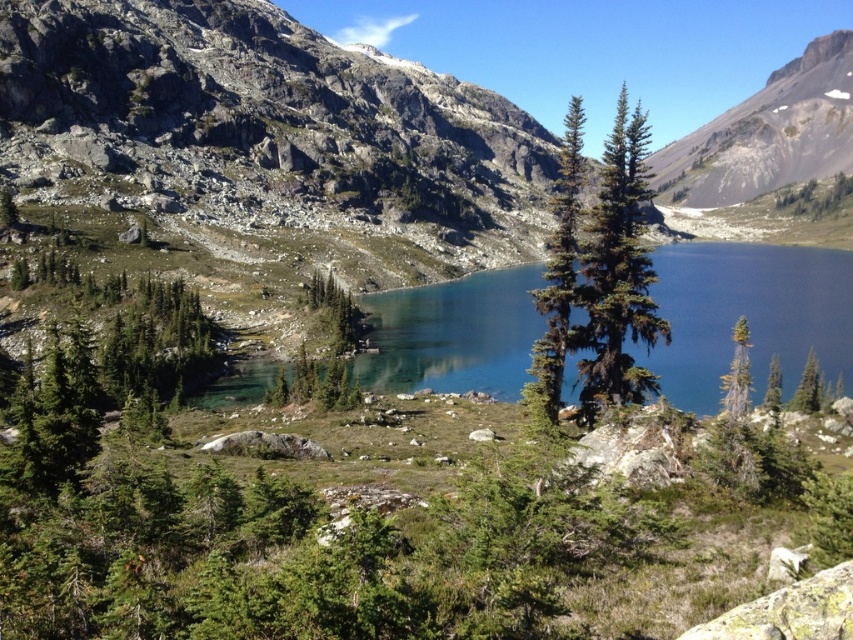
You are a hiker standing at the edge of the lake. You want to take a photo that includes both the clear glass water at center and the green matte tree at center. Which object will appear larger in the photo?

The clear glass water at center will appear larger in the photo because it is much taller than the green matte tree at center.

You are a photographer standing at the edge of the lake in the mountain landscape scene. You want to capture both the point at coordinates point (x=645, y=356) and the point at coordinates point (x=328, y=323) in the same frame. Which point will appear larger in your photo?

Point (x=645, y=356) will appear larger in the photo because it is closer to the camera than point (x=328, y=323).